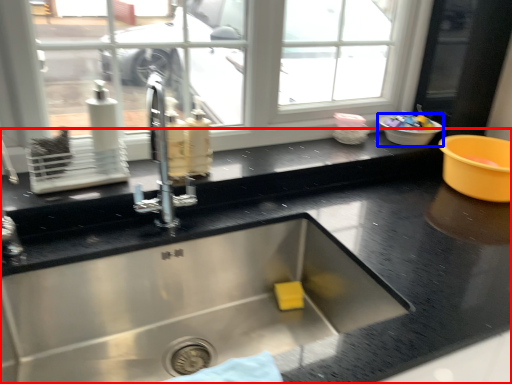
Question: Which object appears farthest to the camera in this image, countertop (highlighted by a red box) or basin (highlighted by a blue box)?

Choices:
 (A) countertop
 (B) basin

Answer: (B)